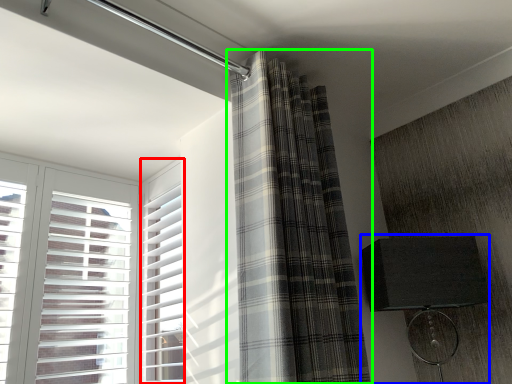
Question: Which is farther away from window frame (highlighted by a red box)? table lamp (highlighted by a blue box) or curtain (highlighted by a green box)?

Choices:
 (A) table lamp
 (B) curtain

Answer: (A)